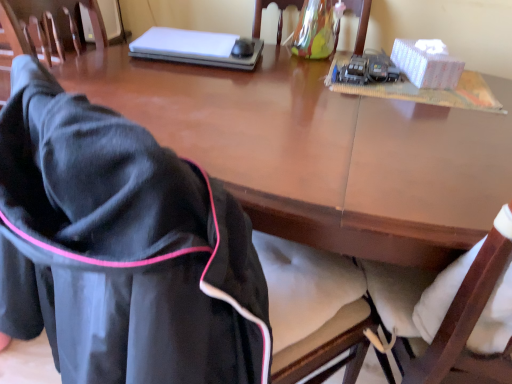
Question: Is white matte laptop at upper center with black plastic mouse at upper center?

Choices:
 (A) no
 (B) yes

Answer: (A)

Question: Is white matte laptop at upper center far away from black plastic mouse at upper center?

Choices:
 (A) no
 (B) yes

Answer: (A)

Question: Considering the relative positions of white matte laptop at upper center and black plastic mouse at upper center in the image provided, is white matte laptop at upper center in front of black plastic mouse at upper center?

Choices:
 (A) no
 (B) yes

Answer: (B)

Question: Is white matte laptop at upper center to the right of black plastic mouse at upper center from the viewer's perspective?

Choices:
 (A) no
 (B) yes

Answer: (A)

Question: Does white matte laptop at upper center have a lesser height compared to black plastic mouse at upper center?

Choices:
 (A) no
 (B) yes

Answer: (A)

Question: Can you confirm if white matte laptop at upper center is taller than black plastic mouse at upper center?

Choices:
 (A) no
 (B) yes

Answer: (B)

Question: Can you confirm if white cardboard box at upper right is positioned to the left of black fabric jacket at lower left, which ranks as the 2th chair in back-to-front order?

Choices:
 (A) yes
 (B) no

Answer: (B)

Question: From the image's perspective, is white cardboard box at upper right over black fabric jacket at lower left, which appears as the 2th chair when viewed from the right?

Choices:
 (A) yes
 (B) no

Answer: (A)

Question: Considering the relative sizes of white cardboard box at upper right and black fabric jacket at lower left, which ranks as the 2th chair in back-to-front order, in the image provided, is white cardboard box at upper right bigger than black fabric jacket at lower left, which ranks as the 2th chair in back-to-front order,?

Choices:
 (A) no
 (B) yes

Answer: (A)

Question: Can you confirm if white cardboard box at upper right is wider than black fabric jacket at lower left, which ranks as the 2th chair in back-to-front order?

Choices:
 (A) no
 (B) yes

Answer: (A)

Question: Can you confirm if white cardboard box at upper right is shorter than black fabric jacket at lower left, which appears as the 2th chair when viewed from the right?

Choices:
 (A) yes
 (B) no

Answer: (A)

Question: Does white cardboard box at upper right have a lesser width compared to black fabric jacket at lower left, which ranks as the 2th chair in back-to-front order?

Choices:
 (A) no
 (B) yes

Answer: (B)

Question: Is black plastic mouse at upper center shorter than black fabric jacket at lower left, which ranks as the 2th chair in back-to-front order?

Choices:
 (A) no
 (B) yes

Answer: (B)